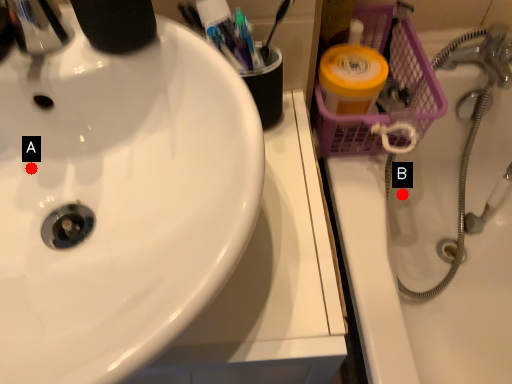
Question: Two points are circled on the image, labeled by A and B beside each circle. Which of the following is the closest to the observer?

Choices:
 (A) A is closer
 (B) B is closer

Answer: (A)